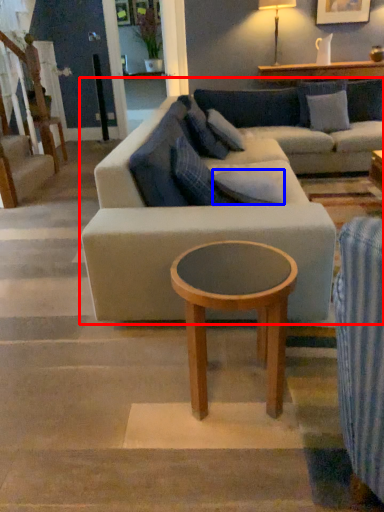
Question: Which point is closer to the camera, studio couch (highlighted by a red box) or pillow (highlighted by a blue box)?

Choices:
 (A) studio couch
 (B) pillow

Answer: (A)